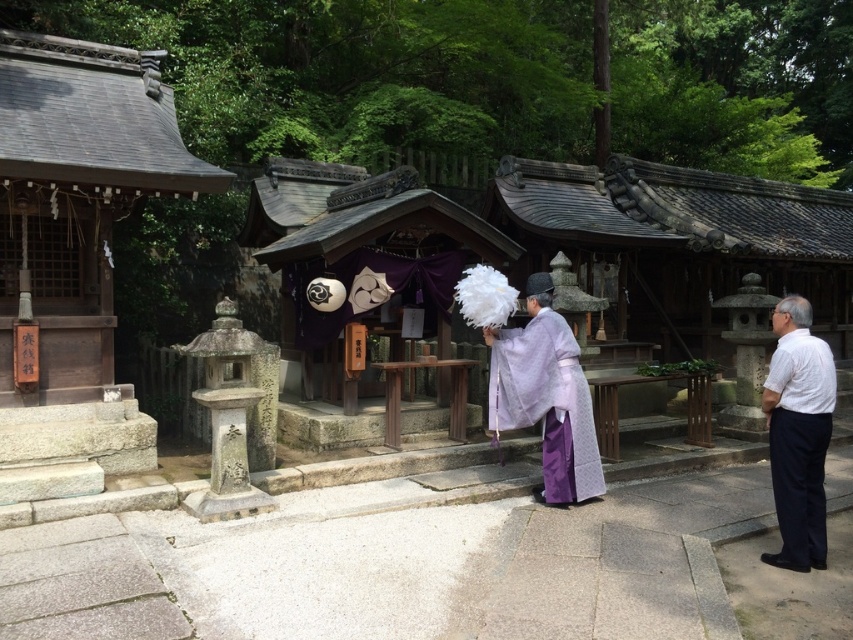
Between white cotton shirt at right and purple satin robe at center, which one is positioned higher?

purple satin robe at center

In order to click on white cotton shirt at right in this screenshot , I will do `click(798, 435)`.

In the scene shown: Does purple silk kimono at center appear on the left side of purple satin robe at center?

Yes, purple silk kimono at center is to the left of purple satin robe at center.

Can you confirm if purple silk kimono at center is bigger than purple satin robe at center?

Yes, purple silk kimono at center is bigger than purple satin robe at center.

Between point (804, 456) and point (584, 385), which one is positioned in front?

Point (804, 456) is more forward.

Where is `purple silk kimono at center`? Image resolution: width=853 pixels, height=640 pixels. purple silk kimono at center is located at coordinates (799, 440).

Does purple silk kimono at center appear under white cotton shirt at right?

No, purple silk kimono at center is not below white cotton shirt at right.

Can you confirm if purple silk kimono at center is thinner than white cotton shirt at right?

Incorrect, purple silk kimono at center's width is not less than white cotton shirt at right's.

Is point (505, 387) closer to viewer compared to point (805, 561)?

No, it is behind (805, 561).

You are a GUI agent. You are given a task and a screenshot of the screen. Output one action in this format:
    pyautogui.click(x=<x>, y=<y>)
    Task: Click on the purple silk kimono at center
    The image size is (853, 640).
    Given the screenshot: What is the action you would take?
    pyautogui.click(x=799, y=440)